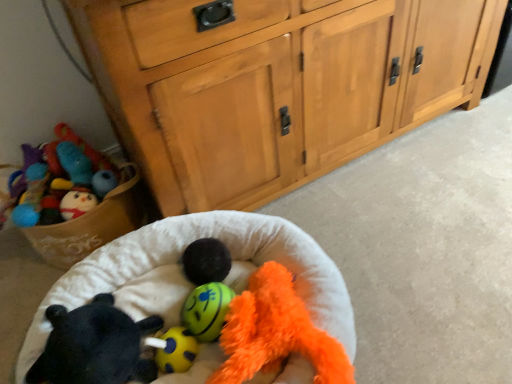
This screenshot has height=384, width=512. Identify the location of vacant space that's between wooden cabinet at center and soft plush infant bed at center. (397, 214).